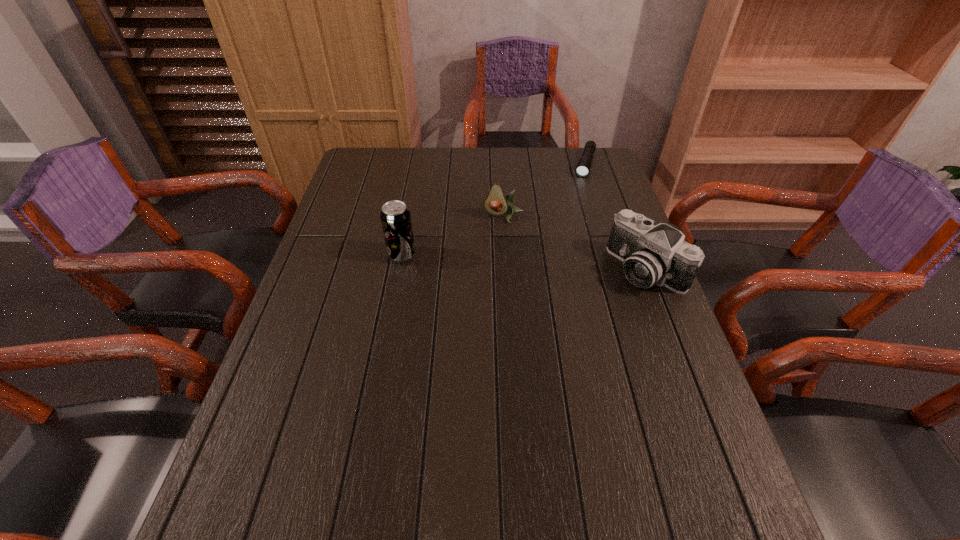
Identify which object is located as the third nearest to the farthest object. Please provide its 2D coordinates. Your answer should be formatted as a tuple, i.e. [(x, y)], where the tuple contains the x and y coordinates of a point satisfying the conditions above.

[(395, 217)]

At what (x,y) coordinates should I click in order to perform the action: click on free space that satisfies the following two spatial constraints: 1. on the back side of the leftmost object; 2. on the left side of the third nearest object. Please return your answer as a coordinate pair (x, y). The image size is (960, 540). Looking at the image, I should click on (409, 217).

Locate an element on the screen. This screenshot has height=540, width=960. vacant space that satisfies the following two spatial constraints: 1. on the front side of the camera; 2. on the right side of the farthest object is located at coordinates (619, 269).

Find the location of a particular element. The image size is (960, 540). vacant area in the image that satisfies the following two spatial constraints: 1. on the front side of the flashlight; 2. on the left side of the camera is located at coordinates (619, 269).

I want to click on free spot that satisfies the following two spatial constraints: 1. on the back side of the leftmost object; 2. on the left side of the farthest object, so click(x=419, y=164).